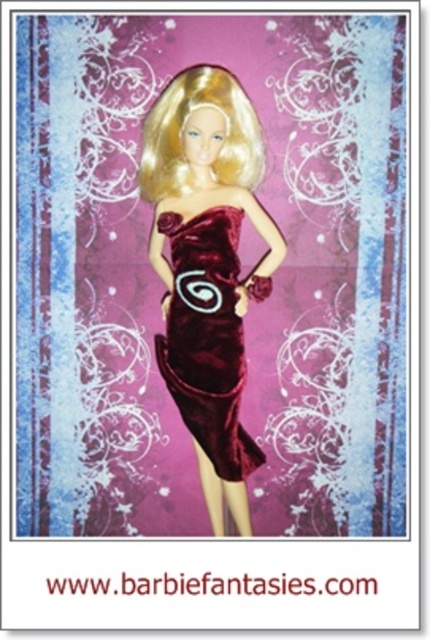
Question: Which point is farther to the camera?

Choices:
 (A) velvet burgundy dress at center
 (B) velvet dress at center

Answer: (A)

Question: Observing the image, what is the correct spatial positioning of velvet dress at center in reference to velvet burgundy dress at center?

Choices:
 (A) right
 (B) left

Answer: (A)

Question: Which object is farther from the camera taking this photo?

Choices:
 (A) velvet dress at center
 (B) velvet burgundy dress at center

Answer: (B)

Question: Can you confirm if velvet dress at center is smaller than velvet burgundy dress at center?

Choices:
 (A) yes
 (B) no

Answer: (B)

Question: Can you confirm if velvet dress at center is bigger than velvet burgundy dress at center?

Choices:
 (A) no
 (B) yes

Answer: (B)